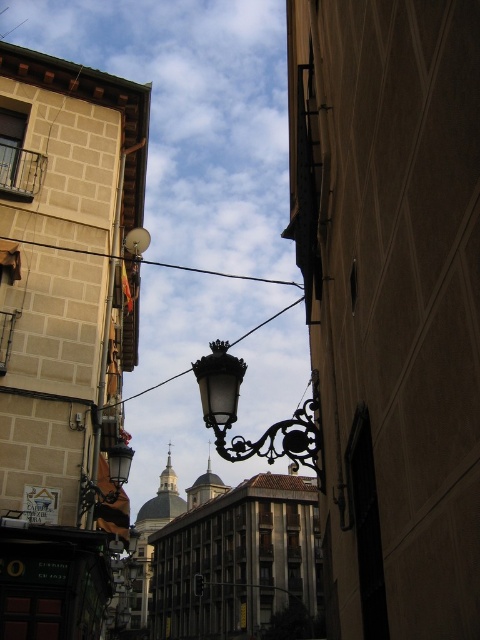
Question: Is polished brass lantern at center above black glass wire at center?

Choices:
 (A) no
 (B) yes

Answer: (B)

Question: Which point is farther to the camera?

Choices:
 (A) (160, 260)
 (B) (227, 360)
 (C) (269, 316)

Answer: (C)

Question: Can you confirm if black wire at upper center is smaller than black glass wire at center?

Choices:
 (A) yes
 (B) no

Answer: (A)

Question: Is polished brass lantern at center thinner than black glass wire at center?

Choices:
 (A) yes
 (B) no

Answer: (A)

Question: Which of the following is the closest to the observer?

Choices:
 (A) (215, 419)
 (B) (144, 390)
 (C) (173, 262)

Answer: (A)

Question: Estimate the real-world distances between objects in this image. Which object is farther from the black glass wire at center?

Choices:
 (A) black wire at upper center
 (B) polished brass lantern at center

Answer: (B)